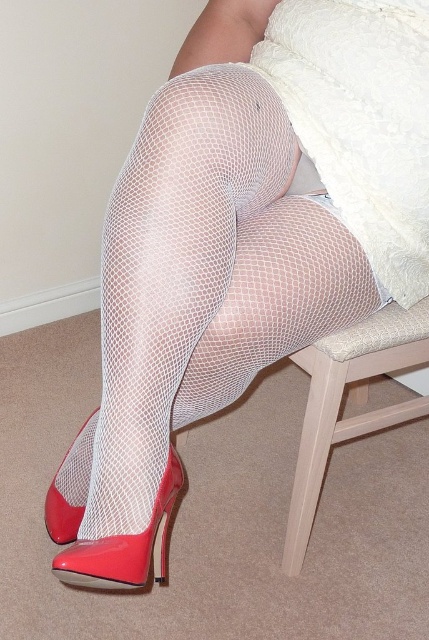
Is white lace pillow at upper center taller than matte red high-heeled shoe at lower left?

Yes, white lace pillow at upper center is taller than matte red high-heeled shoe at lower left.

Who is positioned more to the left, white lace pillow at upper center or matte red high-heeled shoe at lower left?

matte red high-heeled shoe at lower left

Is point (401, 109) closer to camera compared to point (53, 522)?

Yes, point (401, 109) is in front of point (53, 522).

Where is `white lace pillow at upper center`? white lace pillow at upper center is located at coordinates (362, 120).

Who is positioned more to the left, shiny patent leather high-heeled shoe at lower left or matte red high-heeled shoe at lower left?

matte red high-heeled shoe at lower left is more to the left.

Between shiny patent leather high-heeled shoe at lower left and matte red high-heeled shoe at lower left, which one has less height?

Standing shorter between the two is shiny patent leather high-heeled shoe at lower left.

What do you see at coordinates (124, 547) in the screenshot?
I see `shiny patent leather high-heeled shoe at lower left` at bounding box center [124, 547].

Find the location of a particular element. Image resolution: width=429 pixels, height=640 pixels. shiny patent leather high-heeled shoe at lower left is located at coordinates (124, 547).

Can you confirm if light wood stool at lower center is shorter than shiny patent leather high-heeled shoe at lower left?

In fact, light wood stool at lower center may be taller than shiny patent leather high-heeled shoe at lower left.

In the scene shown: Is light wood stool at lower center below shiny patent leather high-heeled shoe at lower left?

Incorrect, light wood stool at lower center is not positioned below shiny patent leather high-heeled shoe at lower left.

This screenshot has height=640, width=429. Find the location of `light wood stool at lower center`. light wood stool at lower center is located at coordinates (353, 400).

I want to click on light wood stool at lower center, so tap(353, 400).